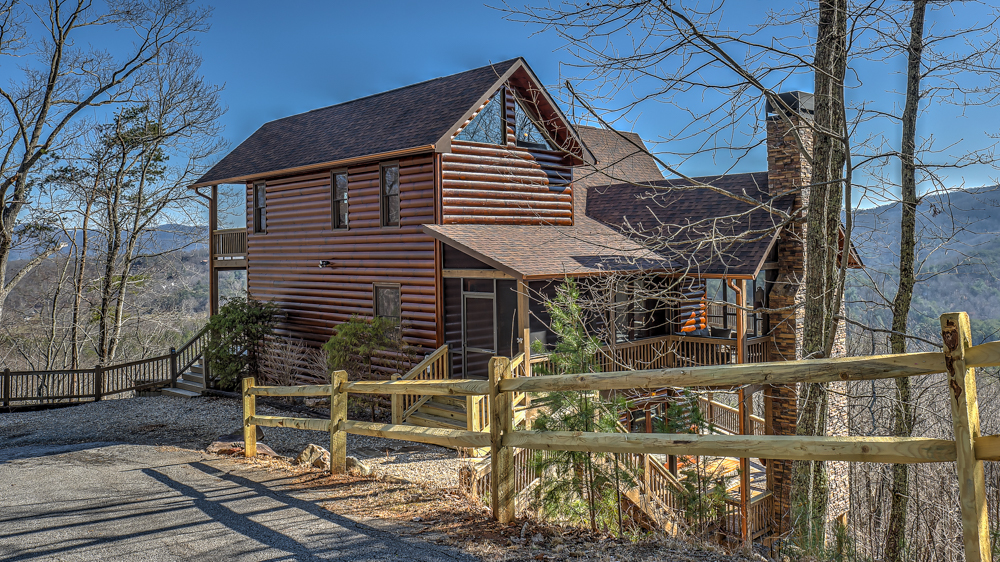
Identify the location of stairs. The width and height of the screenshot is (1000, 562). (184, 378), (440, 409), (648, 506).